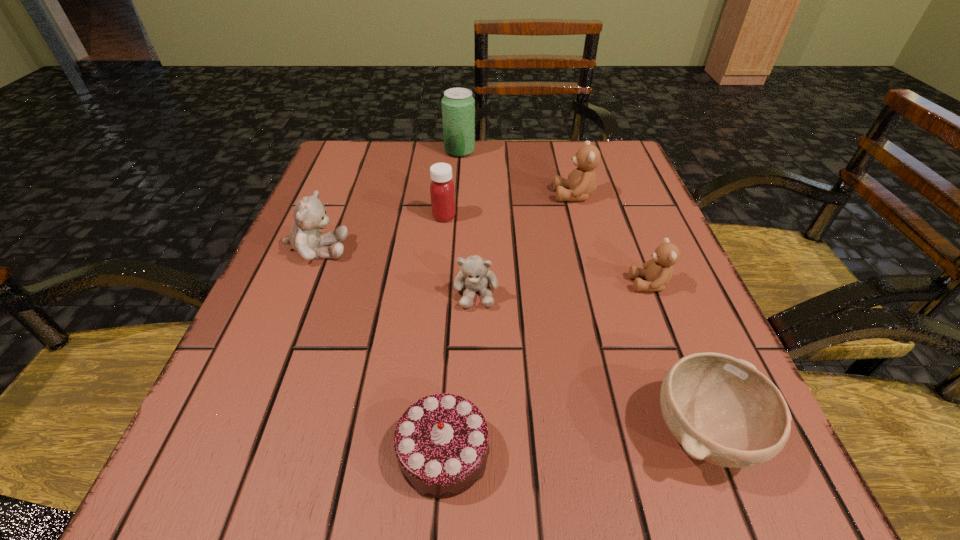
Image resolution: width=960 pixels, height=540 pixels. I want to click on free spot located 0.070m on the right of the red medicine, so click(490, 217).

Image resolution: width=960 pixels, height=540 pixels. In order to click on vacant space located 0.070m on the front-facing side of the smaller brown teddy bear in this screenshot , I will do `click(591, 284)`.

This screenshot has width=960, height=540. Identify the location of free space located 0.240m on the front-facing side of the smaller brown teddy bear. point(495,284).

Locate an element on the screen. Image resolution: width=960 pixels, height=540 pixels. vacant region located 0.400m on the front-facing side of the smaller brown teddy bear is located at coordinates (405, 284).

At what (x,y) coordinates should I click in order to perform the action: click on vacant space located 0.220m on the face of the nearer gray teddy bear. Please return your answer as a coordinate pair (x, y). The height and width of the screenshot is (540, 960). Looking at the image, I should click on (475, 438).

Identify the location of vacant space located 0.140m on the back of the bowl. The width and height of the screenshot is (960, 540). (658, 313).

Identify the location of free space located 0.250m on the back of the shortest object. (454, 282).

Find the location of a particular element. soda present at the far edge is located at coordinates tap(458, 105).

Locate an element on the screen. teddy bear present at the far edge is located at coordinates (581, 182).

Where is `bowl that is positioned at the near edge`? Image resolution: width=960 pixels, height=540 pixels. bowl that is positioned at the near edge is located at coordinates (722, 410).